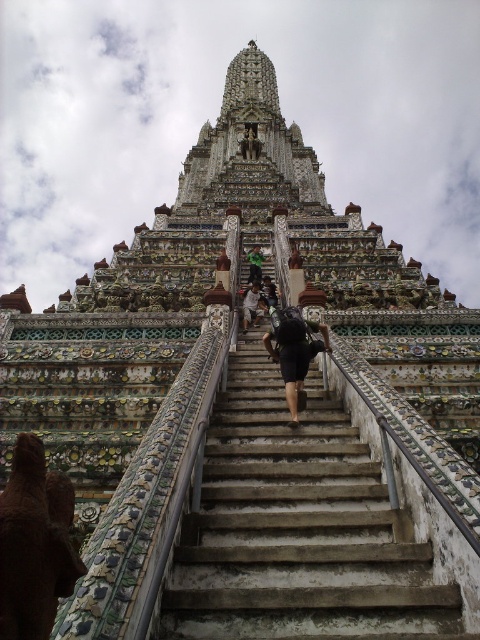
Question: Which object is closer to the camera taking this photo?

Choices:
 (A) black matte backpack at center
 (B) dark gray backpack at center
 (C) concrete stairs at center
 (D) green fabric at center

Answer: (C)

Question: Does concrete stairs at center appear on the left side of black matte backpack at center?

Choices:
 (A) no
 (B) yes

Answer: (B)

Question: Which object is farther from the camera taking this photo?

Choices:
 (A) dark gray backpack at center
 (B) black matte backpack at center
 (C) concrete stairs at center
 (D) green fabric at center

Answer: (D)

Question: Can you confirm if green fabric at center is positioned to the right of dark blue fabric backpack at center?

Choices:
 (A) no
 (B) yes

Answer: (A)

Question: Is green fabric at center to the left of dark blue fabric backpack at center from the viewer's perspective?

Choices:
 (A) yes
 (B) no

Answer: (A)

Question: Among these objects, which one is nearest to the camera?

Choices:
 (A) dark gray backpack at center
 (B) concrete stairs at center

Answer: (B)